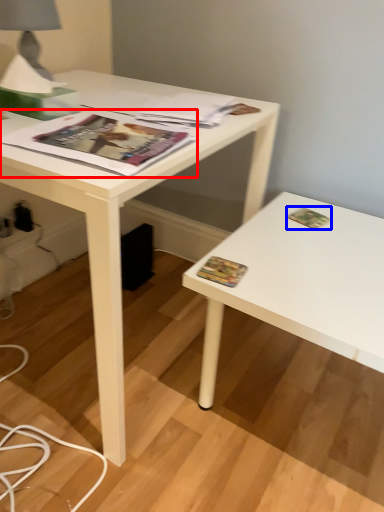
Question: Which point is further to the camera, magazine (highlighted by a red box) or paperback book (highlighted by a blue box)?

Choices:
 (A) magazine
 (B) paperback book

Answer: (B)